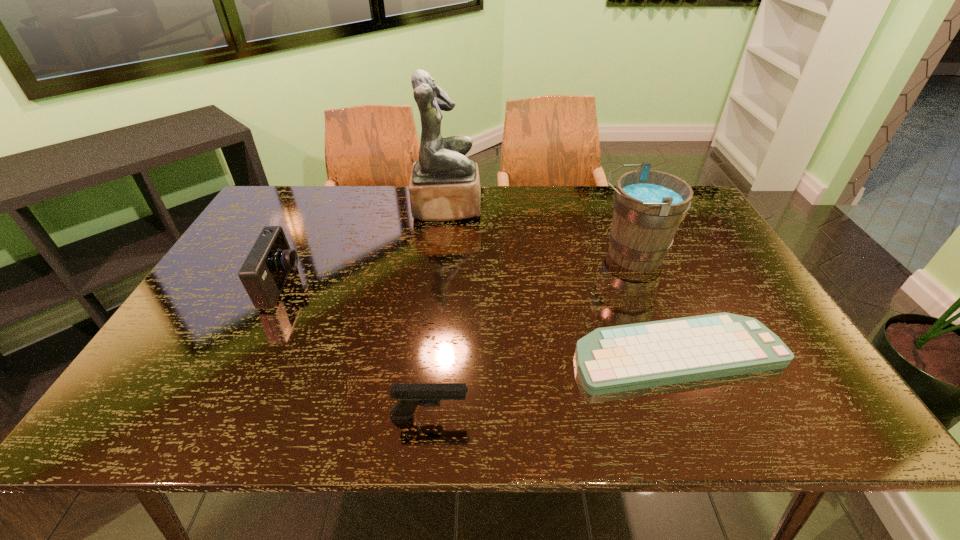
Find the location of a particular element. The image size is (960, 540). vacant area between the second shortest object and the shortest object is located at coordinates (554, 386).

Locate an element on the screen. free spot between the shortest object and the farthest object is located at coordinates (563, 281).

In order to click on free point between the leftmost object and the farthest object in this screenshot , I will do `click(365, 247)`.

Identify the location of free area in between the third shortest object and the tallest object. coord(365,247).

The height and width of the screenshot is (540, 960). I want to click on blank region between the computer keyboard and the fourth shortest object, so click(655, 305).

Find the location of a particular element. This screenshot has width=960, height=540. empty space between the leftmost object and the fourth shortest object is located at coordinates (457, 270).

The width and height of the screenshot is (960, 540). I want to click on empty space between the sculpture and the fourth shortest object, so [540, 231].

I want to click on vacant area that lies between the farthest object and the second shortest object, so click(x=439, y=312).

Identify the location of object that stands as the second closest to the fourth tallest object. The width and height of the screenshot is (960, 540). (263, 274).

Identify the location of object that can be found as the second closest to the second nearest object. (410, 395).